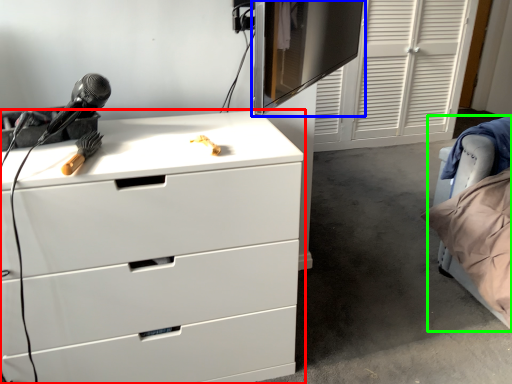
Question: Which is farther away from chest of drawers (highlighted by a red box)? computer monitor (highlighted by a blue box) or bed (highlighted by a green box)?

Choices:
 (A) computer monitor
 (B) bed

Answer: (A)